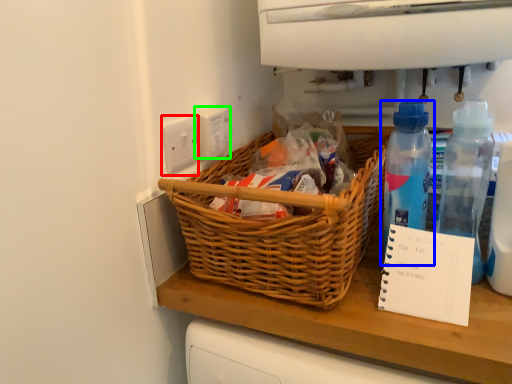
Question: Which object is positioned closest to electric outlet (highlighted by a red box)? Select from bottle (highlighted by a blue box) and electric outlet (highlighted by a green box).

Choices:
 (A) bottle
 (B) electric outlet

Answer: (B)